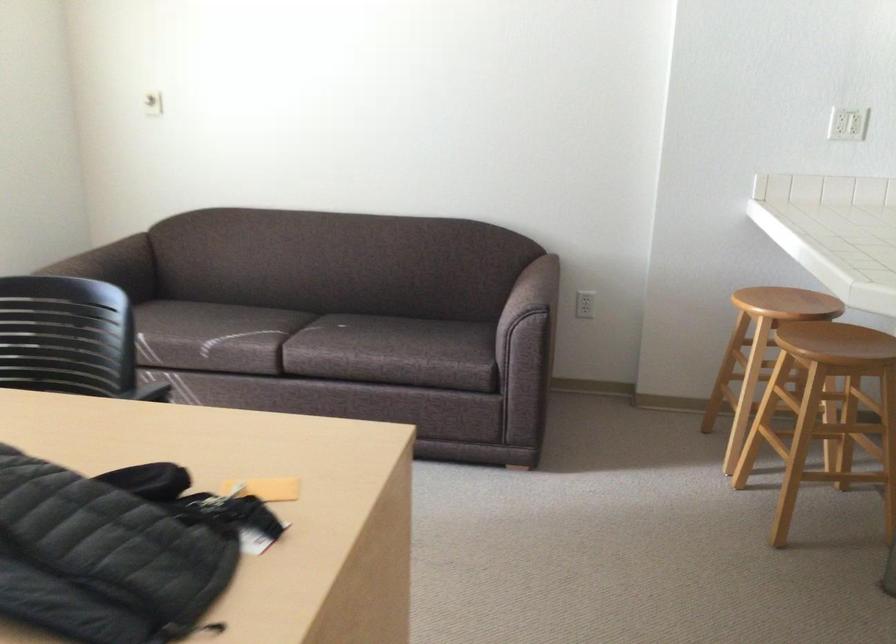
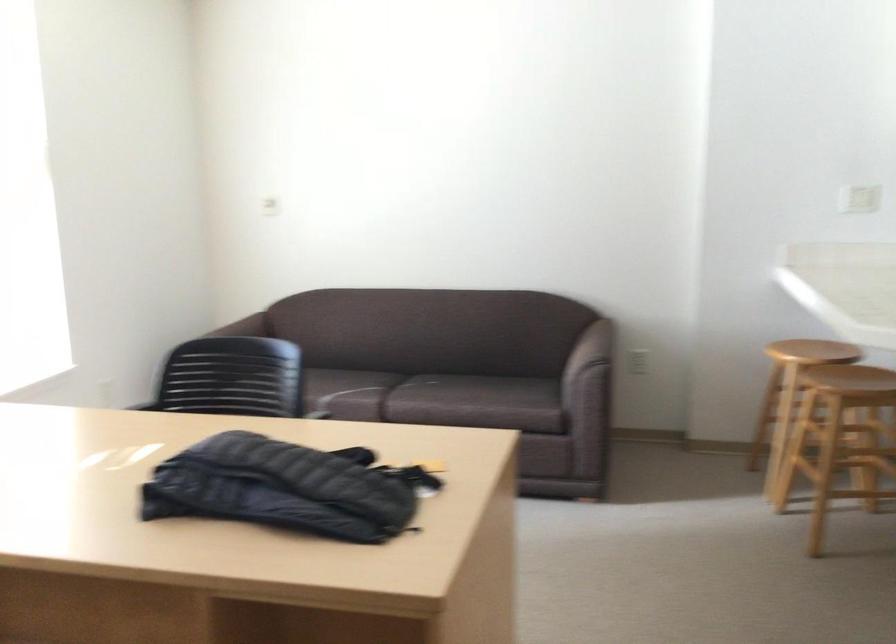
Locate, in the second image, the point that corresponds to point 527,297 in the first image.

(590, 348)